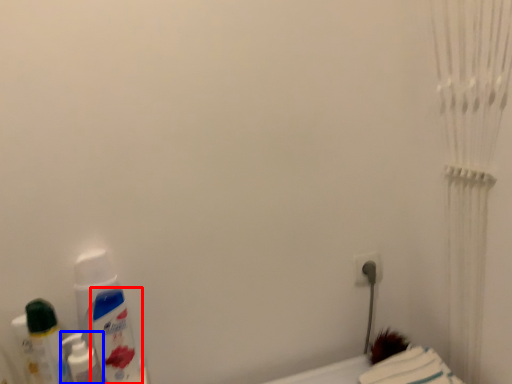
Question: Which object appears closest to the camera in this image, mouthwash (highlighted by a red box) or mouthwash (highlighted by a blue box)?

Choices:
 (A) mouthwash
 (B) mouthwash

Answer: (B)